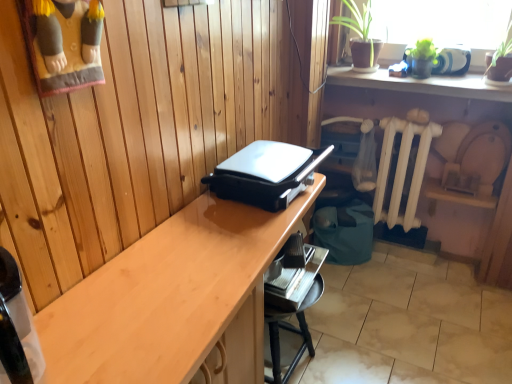
Question: Is black plastic waffle iron at center wider or thinner than white painted metal radiator at lower right?

Choices:
 (A) wide
 (B) thin

Answer: (A)

Question: Is black plastic waffle iron at center inside or outside of white painted metal radiator at lower right?

Choices:
 (A) inside
 (B) outside

Answer: (B)

Question: Which object is the closest to the white painted metal radiator at lower right?

Choices:
 (A) black plastic waffle iron at center
 (B) light wood desk at center
 (C) green matte shelf at upper right

Answer: (C)

Question: Based on their relative distances, which object is nearer to the green matte shelf at upper right?

Choices:
 (A) white painted metal radiator at lower right
 (B) black plastic waffle iron at center
 (C) light wood desk at center

Answer: (A)